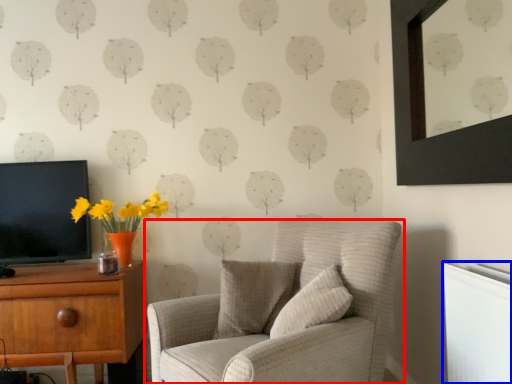
Question: Which object is further to the camera taking this photo, chair (highlighted by a red box) or radiator (highlighted by a blue box)?

Choices:
 (A) chair
 (B) radiator

Answer: (A)